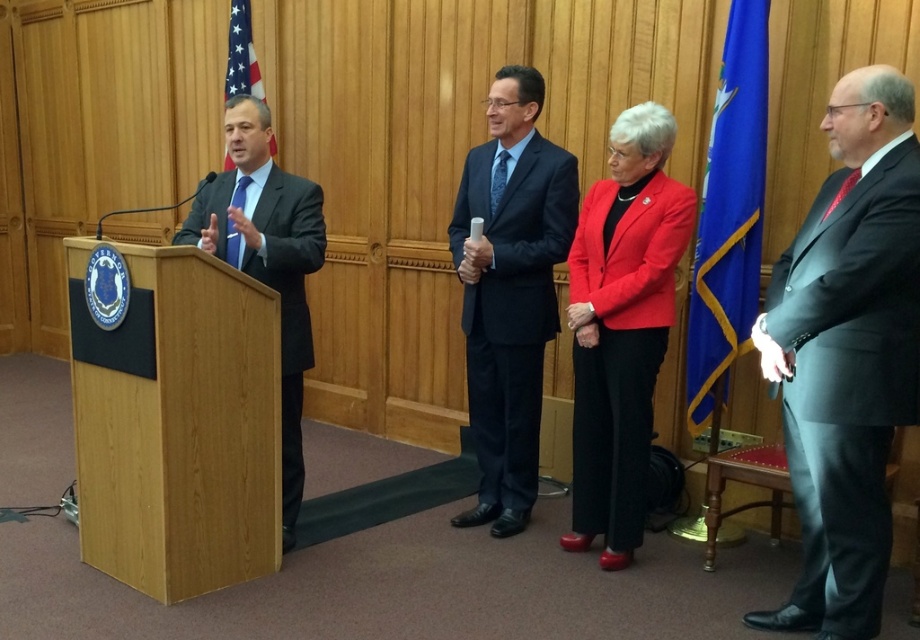
Is dark gray suit at right to the right of dark blue suit at left from the viewer's perspective?

Correct, you'll find dark gray suit at right to the right of dark blue suit at left.

Measure the distance from dark gray suit at right to dark blue suit at left.

dark gray suit at right and dark blue suit at left are 6.20 feet apart from each other.

Describe the element at coordinates (847, 381) in the screenshot. I see `dark gray suit at right` at that location.

The image size is (920, 640). In order to click on dark gray suit at right in this screenshot , I will do `click(847, 381)`.

Who is taller, matte red blazer at center or dark blue suit at left?

With more height is matte red blazer at center.

Can you confirm if matte red blazer at center is wider than dark blue suit at left?

No.

Between point (598, 353) and point (307, 186), which one is positioned behind?

Point (598, 353)

You are a GUI agent. You are given a task and a screenshot of the screen. Output one action in this format:
    pyautogui.click(x=<x>, y=<y>)
    Task: Click on the matte red blazer at center
    
    Given the screenshot: What is the action you would take?
    pyautogui.click(x=621, y=344)

Between blue fabric flag at right and dark blue textured suit at center, which one appears on the right side from the viewer's perspective?

From the viewer's perspective, blue fabric flag at right appears more on the right side.

Is blue fabric flag at right bigger than dark blue textured suit at center?

No.

At what (x,y) coordinates should I click in order to perform the action: click on blue fabric flag at right. Please return your answer as a coordinate pair (x, y). This screenshot has height=640, width=920. Looking at the image, I should click on (729, 212).

Identify the location of blue fabric flag at right. The image size is (920, 640). (729, 212).